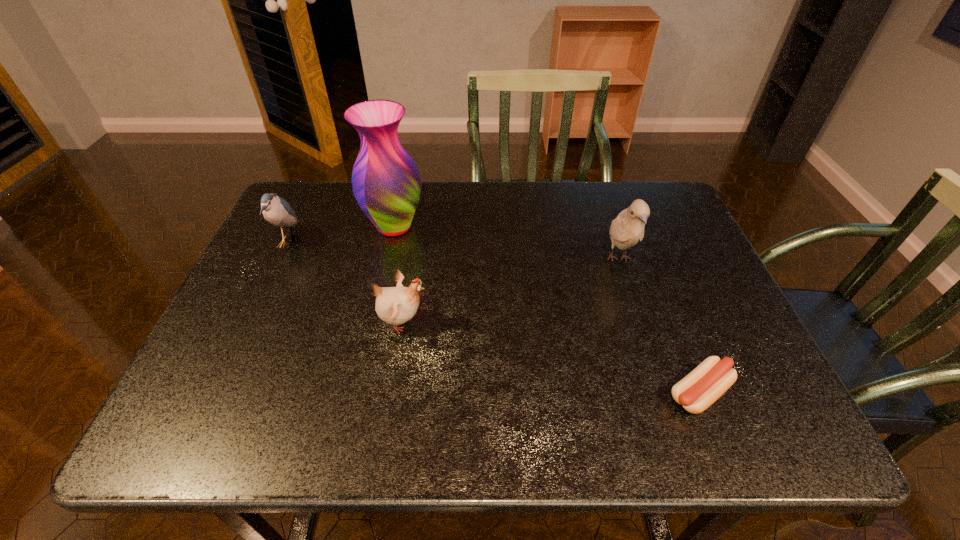
Locate an element on the screen. The width and height of the screenshot is (960, 540). free space between the rightmost bird and the shortest object is located at coordinates (659, 326).

Locate an element on the screen. free spot between the leftmost object and the sausage is located at coordinates (493, 318).

You are a GUI agent. You are given a task and a screenshot of the screen. Output one action in this format:
    pyautogui.click(x=<x>, y=<y>)
    Task: Click on the free space between the leftmost bird and the sausage
    This screenshot has height=540, width=960.
    Given the screenshot: What is the action you would take?
    (x=493, y=318)

Identify the location of empty space between the leftmost bird and the second bird from left to right. This screenshot has height=540, width=960. (345, 282).

Identify the location of free space between the second tallest bird and the rightmost bird. (453, 250).

I want to click on vacant space that is in between the second tallest object and the leftmost bird, so coord(453,250).

This screenshot has width=960, height=540. Find the location of `empty space that is in between the rightmost bird and the third shortest object`. empty space that is in between the rightmost bird and the third shortest object is located at coordinates (453, 250).

Identify the location of object that stands as the third closest to the leftmost bird. The width and height of the screenshot is (960, 540). (627, 229).

The image size is (960, 540). What are the coordinates of `object that is the nearest to the third tallest object` in the screenshot? It's located at 386,183.

Point out which bird is positioned as the nearest to the tallest bird. Please provide its 2D coordinates. Your answer should be formatted as a tuple, i.e. [(x, y)], where the tuple contains the x and y coordinates of a point satisfying the conditions above.

[(394, 305)]